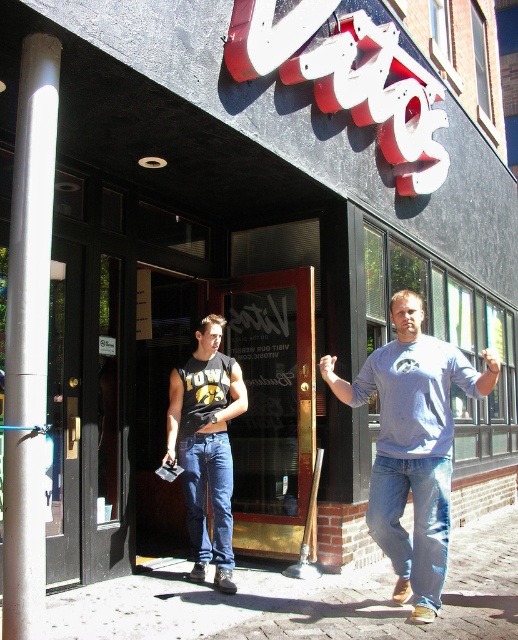
Question: Can you confirm if light blue cotton t-shirt at center is thinner than matte black tank top at center?

Choices:
 (A) no
 (B) yes

Answer: (A)

Question: Does brick pavement at lower center appear over matte black tank top at center?

Choices:
 (A) yes
 (B) no

Answer: (B)

Question: Which point is farther to the camera?

Choices:
 (A) (191, 449)
 (B) (396, 296)
 (C) (426, 528)
 (D) (496, 568)

Answer: (D)

Question: Which point is closer to the camera?

Choices:
 (A) light blue denim jeans at lower right
 (B) denim jeans at center
 (C) brick pavement at lower center
 (D) light blue cotton t-shirt at center

Answer: (D)

Question: Which point is farther to the camera?

Choices:
 (A) (194, 499)
 (B) (384, 548)

Answer: (A)

Question: Can you confirm if light blue denim jeans at lower right is positioned above denim jeans at center?

Choices:
 (A) yes
 (B) no

Answer: (A)